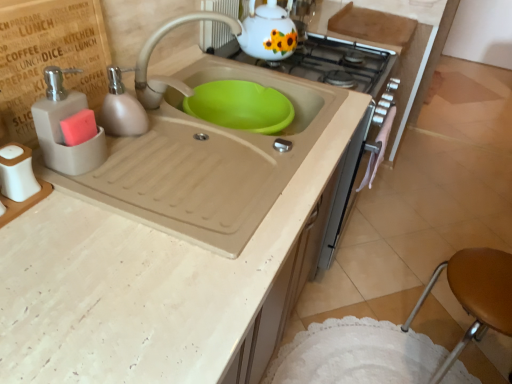
At what (x,y) coordinates should I click in order to perform the action: click on vacant area that is situated to the right of white ceramic teapot at upper center. Please return your answer as a coordinate pair (x, y). Looking at the image, I should click on (323, 61).